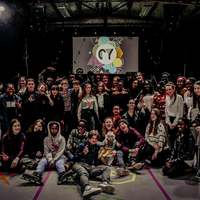
The height and width of the screenshot is (200, 200). Identify the location of screen. (126, 62).